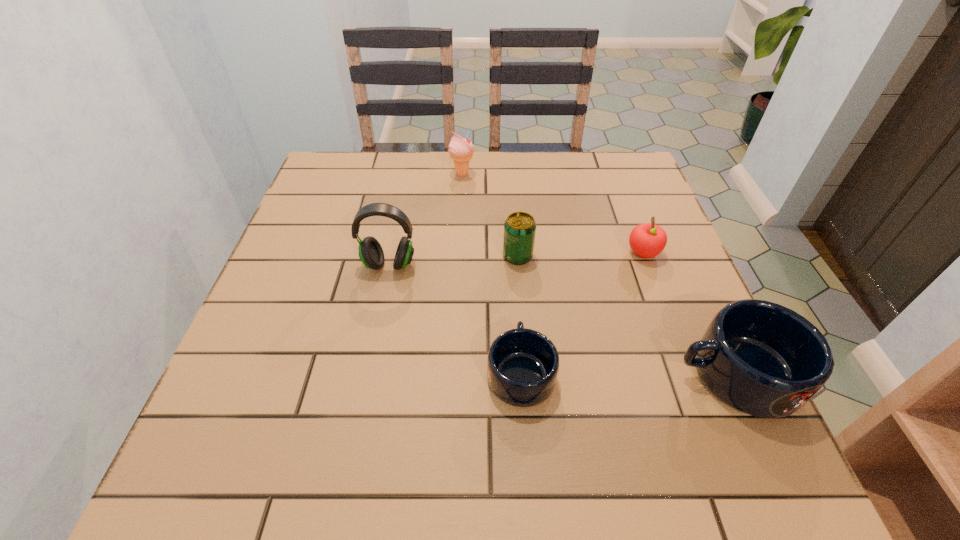
Identify the location of vacant space located with the handle on the side of the left mug. This screenshot has width=960, height=540. pyautogui.click(x=515, y=287).

What are the coordinates of `vacant space positioned with the handle on the side of the left mug` in the screenshot? It's located at (510, 218).

This screenshot has height=540, width=960. What are the coordinates of `free location located 0.140m with the handle on the side of the taller mug` in the screenshot? It's located at pos(598,374).

At what (x,y) coordinates should I click in order to perform the action: click on free space located with the handle on the side of the taller mug. Please return your answer as a coordinate pair (x, y). Image resolution: width=960 pixels, height=540 pixels. Looking at the image, I should click on (522, 374).

Where is `vacant space located with the handle on the side of the taller mug`? The height and width of the screenshot is (540, 960). vacant space located with the handle on the side of the taller mug is located at coordinates (457, 374).

Where is `vacant space located 0.170m on the right of the icecream`? The image size is (960, 540). vacant space located 0.170m on the right of the icecream is located at coordinates (534, 174).

At what (x,y) coordinates should I click in order to perform the action: click on vacant space situated on the left of the beer can. Please return your answer as a coordinate pair (x, y). Image resolution: width=960 pixels, height=540 pixels. Looking at the image, I should click on (331, 256).

Where is `vacant area situated 0.240m on the left of the apple`? This screenshot has width=960, height=540. vacant area situated 0.240m on the left of the apple is located at coordinates (524, 253).

This screenshot has width=960, height=540. Find the location of `vacant region located on the ear cups of the headset`. vacant region located on the ear cups of the headset is located at coordinates (372, 347).

Image resolution: width=960 pixels, height=540 pixels. Find the location of `object that is at the far edge`. object that is at the far edge is located at coordinates (461, 150).